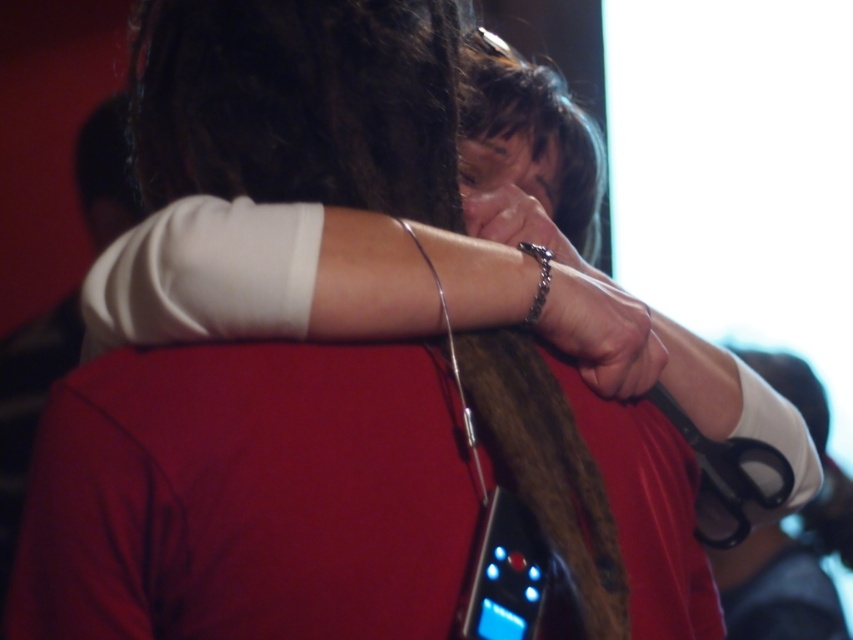
Who is higher up, silver metallic bracelet at upper center or silver metallic chain at upper center?

silver metallic bracelet at upper center is higher up.

Measure the distance between silver metallic bracelet at upper center and camera.

silver metallic bracelet at upper center is 24.74 inches away from camera.

The image size is (853, 640). Find the location of `silver metallic bracelet at upper center`. silver metallic bracelet at upper center is located at coordinates (520, 224).

Does white matte arm at center appear under metallic bracelet at center?

Result: Correct, white matte arm at center is located below metallic bracelet at center.

Between white matte arm at center and metallic bracelet at center, which one has less height?

metallic bracelet at center is shorter.

Is point (312, 321) closer to viewer compared to point (596, 310)?

Yes, it is in front of point (596, 310).

This screenshot has width=853, height=640. In order to click on white matte arm at center in this screenshot , I will do `click(256, 276)`.

Is the position of white matte arm at center less distant than that of silver metallic chain at upper center?

Yes, it is.

Is white matte arm at center to the left of silver metallic chain at upper center from the viewer's perspective?

Indeed, white matte arm at center is positioned on the left side of silver metallic chain at upper center.

Find the location of a particular element. white matte arm at center is located at coordinates (256, 276).

Find the location of a particular element. Image resolution: width=853 pixels, height=640 pixels. white matte arm at center is located at coordinates (256, 276).